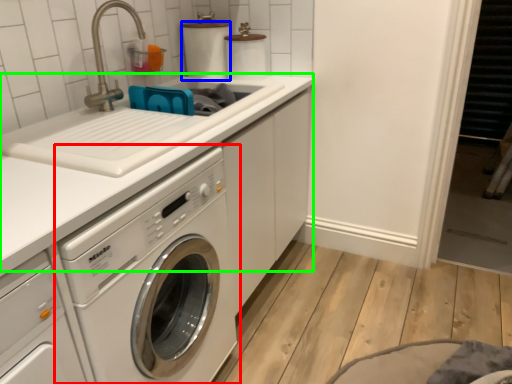
Question: Based on their relative distances, which object is nearer to washing machine (highlighted by a red box)? Choose from toilet paper (highlighted by a blue box) and counter top (highlighted by a green box).

Choices:
 (A) toilet paper
 (B) counter top

Answer: (B)